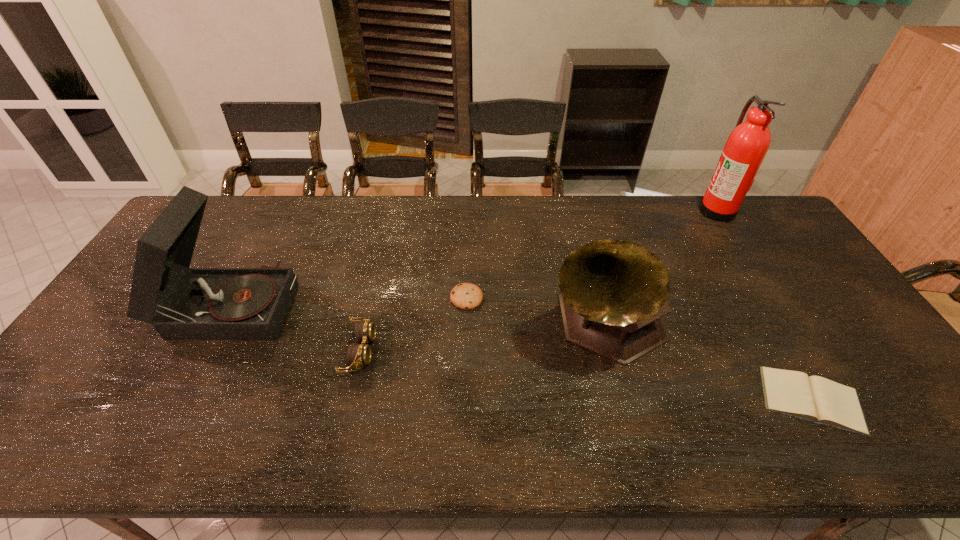
You are a GUI agent. You are given a task and a screenshot of the screen. Output one action in this format:
    pyautogui.click(x=<x>, y=<y>)
    Task: Click on the free space located 0.120m on the label side of the farthest object
    The height and width of the screenshot is (540, 960).
    Given the screenshot: What is the action you would take?
    pyautogui.click(x=665, y=210)

Where is `free point located 0.130m on the label side of the farthest object`? Image resolution: width=960 pixels, height=540 pixels. free point located 0.130m on the label side of the farthest object is located at coordinates (662, 210).

Locate an element on the screen. vacant area located on the front-facing side of the left phonograph record is located at coordinates (399, 303).

Image resolution: width=960 pixels, height=540 pixels. I want to click on free space located on the horn direction of the right phonograph record, so click(x=632, y=430).

Image resolution: width=960 pixels, height=540 pixels. Find the location of `free space located 0.160m through the lenses of the goggles`. free space located 0.160m through the lenses of the goggles is located at coordinates (436, 351).

You are a GUI agent. You are given a task and a screenshot of the screen. Output one action in this format:
    pyautogui.click(x=<x>, y=<y>)
    Task: Click on the free space located 0.150m on the left of the fifth tallest object
    
    Given the screenshot: What is the action you would take?
    pyautogui.click(x=398, y=298)

Where is `free space located on the left of the shortest object`? free space located on the left of the shortest object is located at coordinates (731, 400).

This screenshot has height=540, width=960. What are the coordinates of `object positioned at the far edge` in the screenshot? It's located at (747, 145).

Image resolution: width=960 pixels, height=540 pixels. In order to click on object that is positioned at the near edge in this screenshot , I will do `click(817, 399)`.

At what (x,y) coordinates should I click in order to perform the action: click on object located at the left edge. Please return your answer as a coordinate pair (x, y). Looking at the image, I should click on (182, 303).